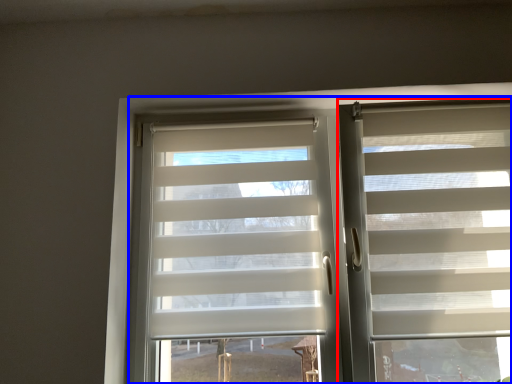
Question: Which point is further to the camera, window blind (highlighted by a red box) or bay window (highlighted by a blue box)?

Choices:
 (A) window blind
 (B) bay window

Answer: (B)